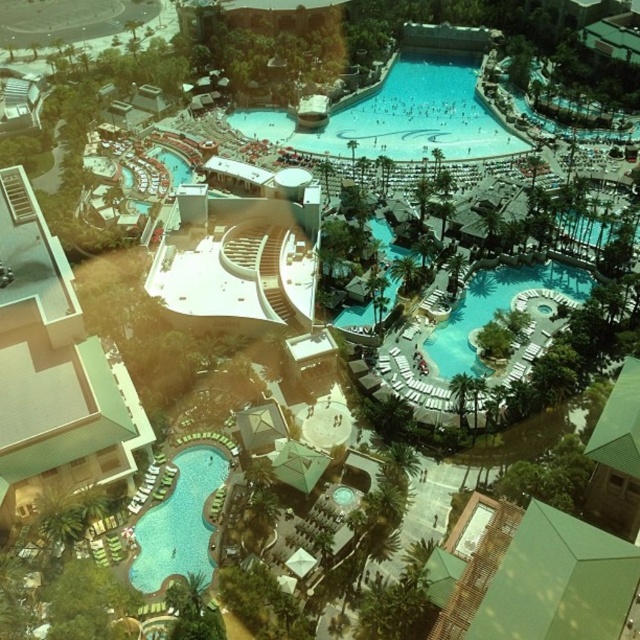
You are a drone operator tasked with capturing aerial footage of the resort complex. Your drone is currently at the center of the image. To reach the white concrete building at lower left, in which general direction should you direct the drone? Please state the direction as a cardinal direction like North, South, etc. or a combination like Northeast.

The white concrete building at lower left is located at point coordinates of 0.578 on the x axis and 0.084 on the y axis. Since the drone is at the center of the image, which would be coordinates around 0.5 on both axes, the building is slightly to the left and much lower in the image. In cardinal directions, this would translate to Southwest direction from the center. Therefore, the drone should be directed Southwest to reach the white concrete building at lower left.

You are standing at the resort complex and want to take a photo of both point (150,561) and point (445,362) in the same frame. Given that your camera has a limited field of view, which point should you position closer to the center of the frame to ensure both are visible?

You should position point (150,561) closer to the center of the frame because it is closer to the viewer than point (445,362), making it easier to include both in the limited field of view.